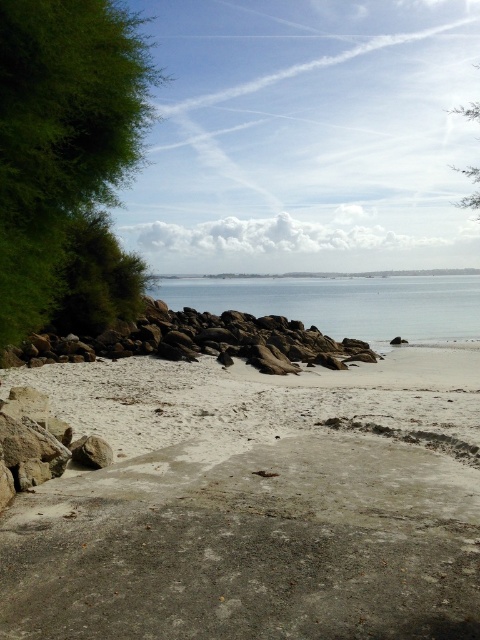
Can you confirm if gray concrete beach at lower left is bigger than green leafy tree at left?

Yes.

The width and height of the screenshot is (480, 640). Find the location of `gray concrete beach at lower left`. gray concrete beach at lower left is located at coordinates (253, 508).

Between green leafy tree at left and green leafy tree at upper right, which one has more height?

green leafy tree at upper right is taller.

Locate an element on the screen. The height and width of the screenshot is (640, 480). green leafy tree at left is located at coordinates (x=61, y=132).

Locate an element on the screen. This screenshot has width=480, height=640. green leafy tree at left is located at coordinates (61, 132).

Does gray concrete beach at lower left appear on the right side of green leafy bush at left?

Yes, gray concrete beach at lower left is to the right of green leafy bush at left.

What do you see at coordinates (253, 508) in the screenshot?
I see `gray concrete beach at lower left` at bounding box center [253, 508].

The width and height of the screenshot is (480, 640). I want to click on gray concrete beach at lower left, so click(x=253, y=508).